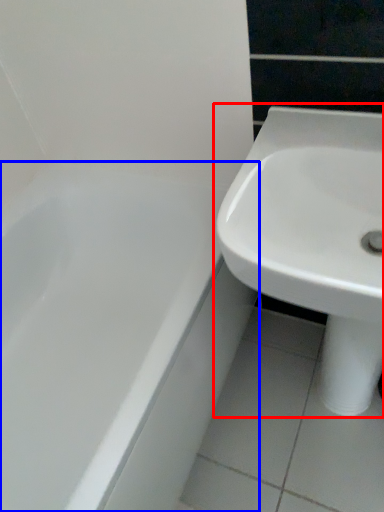
Question: Which object is closer to the camera taking this photo, sink (highlighted by a red box) or bathtub (highlighted by a blue box)?

Choices:
 (A) sink
 (B) bathtub

Answer: (A)